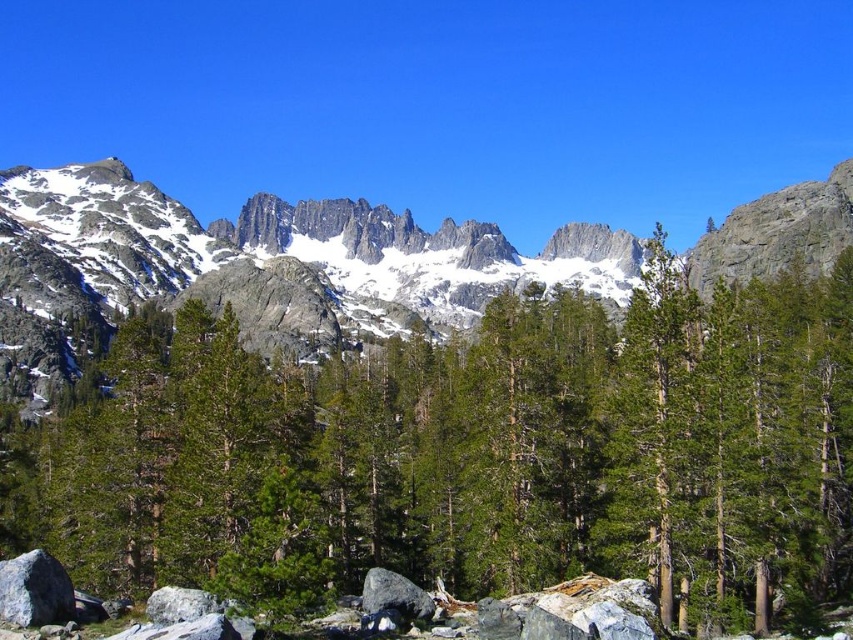
Question: Which object is farther from the camera taking this photo?

Choices:
 (A) green matte tree at center
 (B) gray rough boulder at center
 (C) snowy granite mountain at center

Answer: (C)

Question: Does green matte tree at center have a lesser width compared to snowy granite mountain at center?

Choices:
 (A) yes
 (B) no

Answer: (A)

Question: Is snowy granite mountain at center positioned at the back of gray rough boulder at lower left?

Choices:
 (A) no
 (B) yes

Answer: (B)

Question: Among these objects, which one is nearest to the camera?

Choices:
 (A) gray rough boulder at center
 (B) snowy granite mountain at center
 (C) gray rough boulder at lower left
 (D) green matte tree at center

Answer: (C)

Question: Is snowy granite mountain at center to the right of gray rough boulder at lower left from the viewer's perspective?

Choices:
 (A) yes
 (B) no

Answer: (A)

Question: Which point is closer to the camera?

Choices:
 (A) (184, 342)
 (B) (45, 560)

Answer: (B)